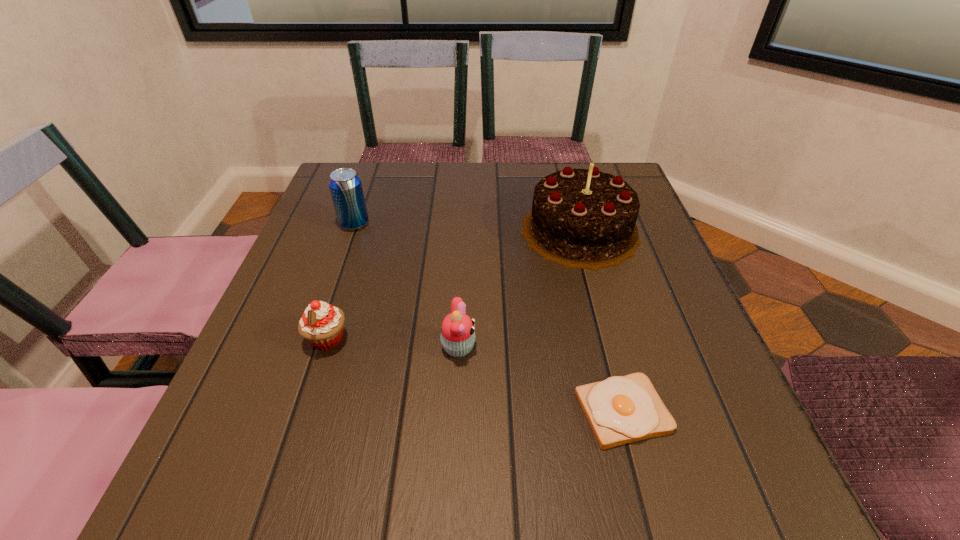
Identify the location of free space located on the left of the shortest object. This screenshot has height=540, width=960. (324, 411).

Image resolution: width=960 pixels, height=540 pixels. I want to click on object that is at the far edge, so click(x=580, y=218).

Where is `beer can present at the left edge`? beer can present at the left edge is located at coordinates (345, 185).

Where is `cupcake at the left edge`? The height and width of the screenshot is (540, 960). cupcake at the left edge is located at coordinates (321, 324).

Find the location of a particular element. birthday cake at the right edge is located at coordinates (580, 218).

Where is `toast that is positioned at the right edge`? toast that is positioned at the right edge is located at coordinates (621, 409).

This screenshot has width=960, height=540. Identify the location of object that is at the far right corner. (580, 218).

Locate an element on the screen. Image resolution: width=960 pixels, height=540 pixels. blank space at the far edge is located at coordinates (515, 200).

At what (x,y) coordinates should I click in order to perform the action: click on vacant space at the near edge. Please return your answer as a coordinate pair (x, y). This screenshot has height=540, width=960. Looking at the image, I should click on (515, 507).

At what (x,y) coordinates should I click in order to perform the action: click on vacant space at the left edge of the desktop. Please return your answer as a coordinate pair (x, y). Looking at the image, I should click on (265, 404).